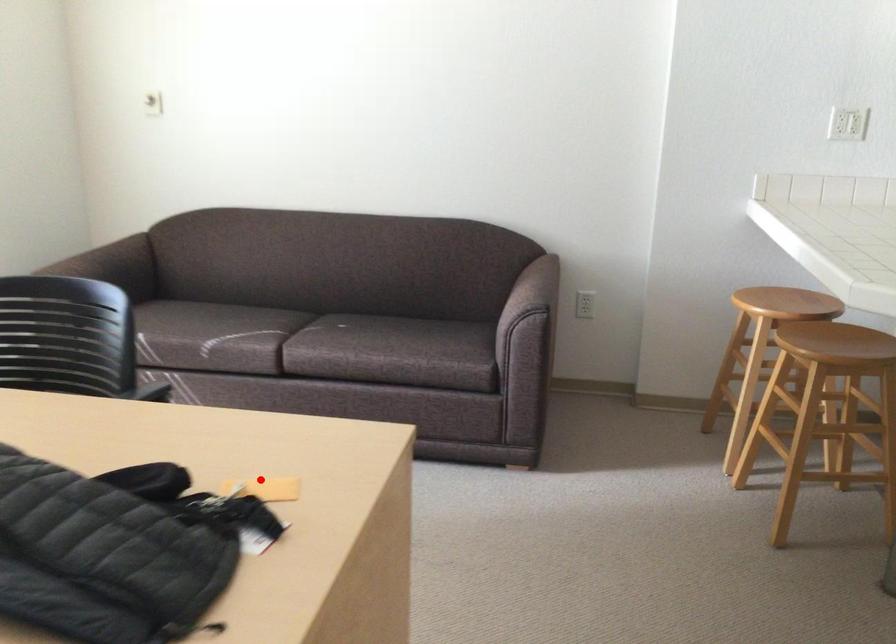
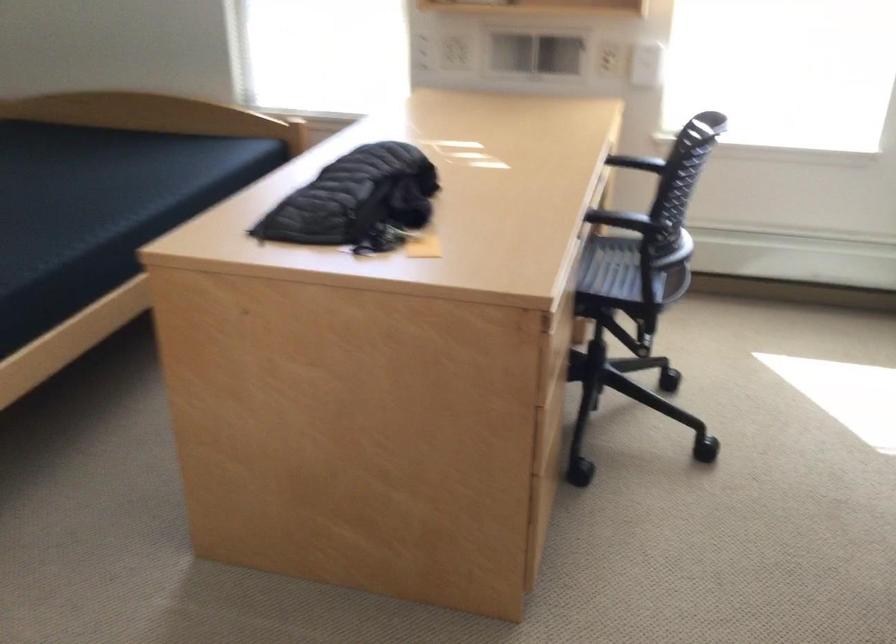
Question: I am providing you with two images of the same scene from different viewpoints. A red point is shown in image1. For the corresponding object point in image2, is it positioned nearer or farther from the camera?

Choices:
 (A) Nearer
 (B) Farther

Answer: (B)